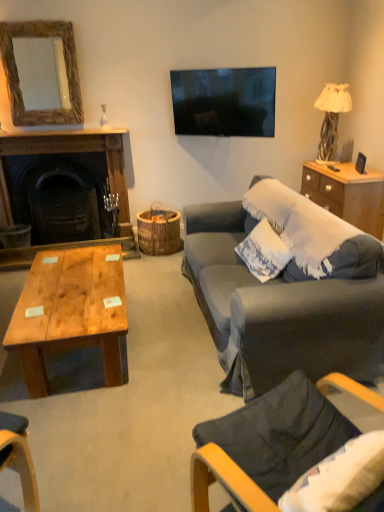
I want to click on vacant space that is to the left of metallic silver picture frame at right, so click(339, 174).